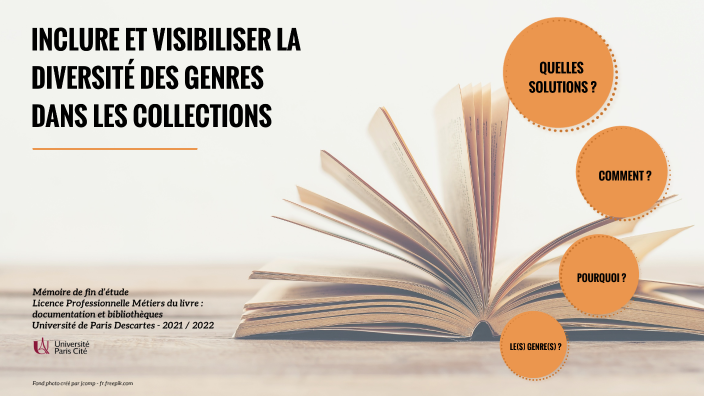
Where is `spine of book`? This screenshot has height=396, width=704. spine of book is located at coordinates (477, 326).